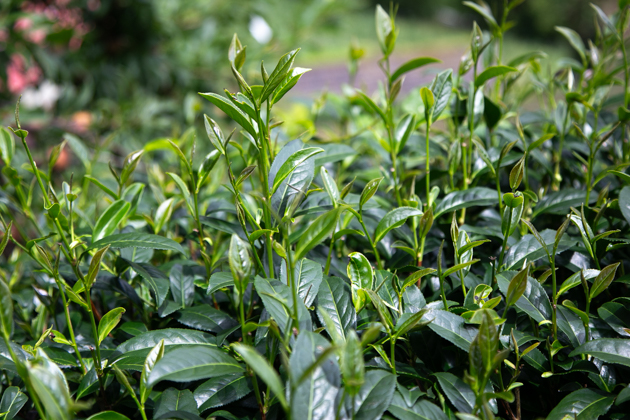
Identify the location of orange flowers. The height and width of the screenshot is (420, 630). (60, 158).